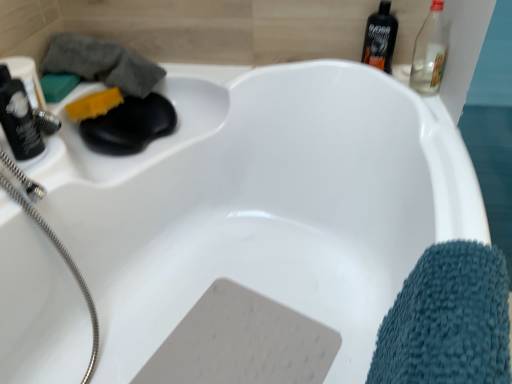
Question: Based on their sizes in the image, would you say black plastic bottle at upper right is bigger or smaller than gray terry cloth towel at upper left, the 1th bath towel positioned from the top?

Choices:
 (A) small
 (B) big

Answer: (A)

Question: Considering the positions of black plastic bottle at upper right and gray terry cloth towel at upper left, positioned as the 2th bath towel in right-to-left order, in the image, is black plastic bottle at upper right taller or shorter than gray terry cloth towel at upper left, positioned as the 2th bath towel in right-to-left order,?

Choices:
 (A) short
 (B) tall

Answer: (B)

Question: Estimate the real-world distances between objects in this image. Which object is farther from the teal microfiber towel at lower right, marked as the second bath towel in a back-to-front arrangement?

Choices:
 (A) matte black shaver at left, acting as the 2th bottle starting from the top
 (B) black plastic bottle at upper right
 (C) clear glass bottle at upper right, which is the 2th bottle in bottom-to-top order
 (D) gray terry cloth towel at upper left, which is counted as the second bath towel, starting from the bottom
 (E) green matte soap at upper left, which ranks as the 1th soap in left-to-right order

Answer: (E)

Question: Based on their relative distances, which object is nearer to the yellow sponge at upper left, the first soap from the right?

Choices:
 (A) matte black shaver at left, arranged as the 1th bottle when viewed from the front
 (B) black plastic bottle at upper right
 (C) gray terry cloth towel at upper left, arranged as the 1th bath towel when viewed from the back
 (D) clear glass bottle at upper right, which is the 2th bottle in bottom-to-top order
 (E) teal microfiber towel at lower right, arranged as the second bath towel when viewed from the left

Answer: (C)